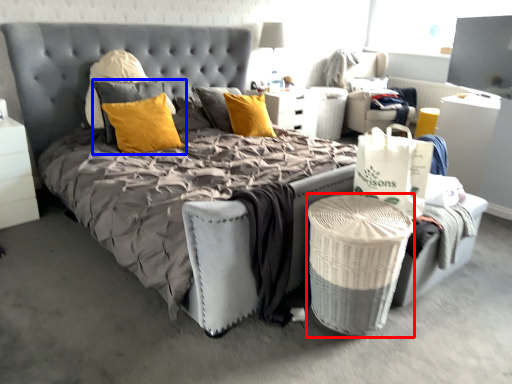
Question: Among these objects, which one is farthest to the camera, laundry basket (highlighted by a red box) or pillow (highlighted by a blue box)?

Choices:
 (A) laundry basket
 (B) pillow

Answer: (B)